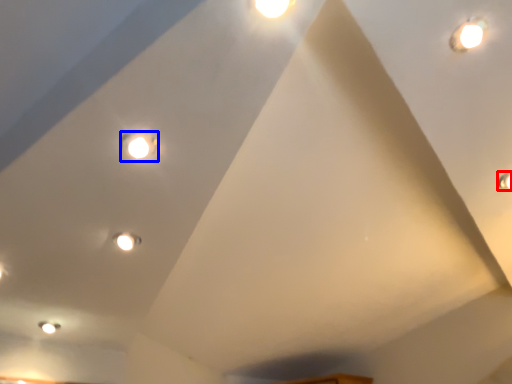
Question: Which object is further to the camera taking this photo, light (highlighted by a red box) or light (highlighted by a blue box)?

Choices:
 (A) light
 (B) light

Answer: (A)